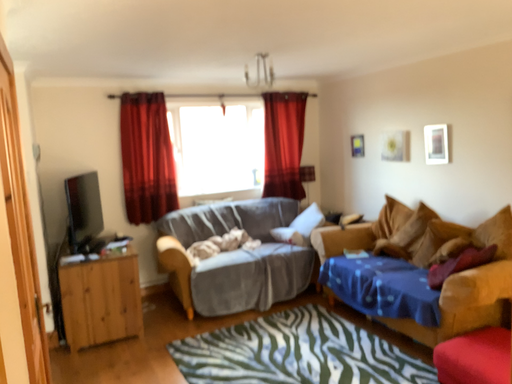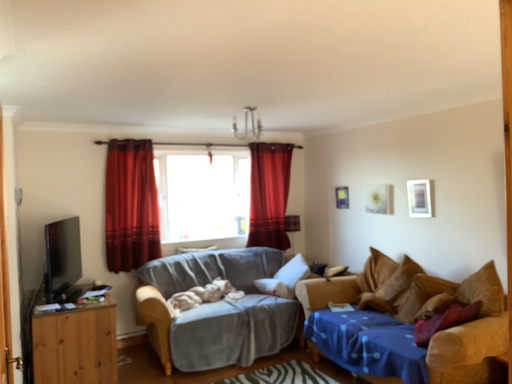
Question: Which way did the camera rotate in the video?

Choices:
 (A) rotated downward
 (B) rotated upward

Answer: (B)